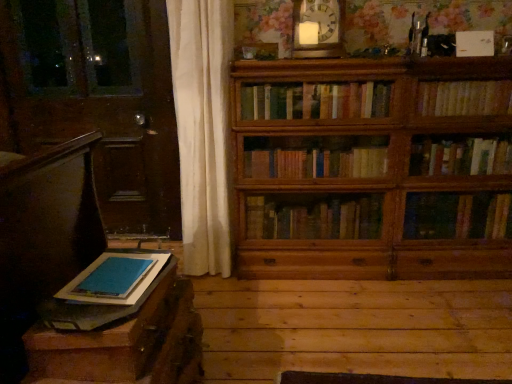
Where is `dark brown leather armchair at left`? dark brown leather armchair at left is located at coordinates (73, 278).

What is the approximate width of wooden table at lower left?

wooden table at lower left is 55.29 centimeters wide.

Describe the element at coordinates (115, 278) in the screenshot. I see `blue felt book at lower left, arranged as the second book when viewed from the back` at that location.

Identify the location of blue felt book at lower left, the first book ordered from the bottom. (115, 278).

Image resolution: width=512 pixels, height=384 pixels. What do you see at coordinates (373, 168) in the screenshot?
I see `wooden bookcase at right` at bounding box center [373, 168].

Identify the location of dark brown leather armchair at left. (73, 278).

Is wooden bookcase at right at the back of wooden table at lower left?

That's not correct — wooden table at lower left is not looking away from wooden bookcase at right.

What's the angular difference between wooden table at lower left and wooden bookcase at right's facing directions?

They differ by 0.715 degrees in their facing directions.

Is wooden table at lower left next to wooden bookcase at right?

wooden table at lower left and wooden bookcase at right are not in contact.

Is wooden table at lower left spatially inside wooden bookcase at right, or outside of it?

wooden table at lower left is outside wooden bookcase at right.

From the image's perspective, is wooden table at lower left on dark brown leather armchair at left?

No.

From a real-world perspective, is wooden table at lower left under dark brown leather armchair at left?

Yes, from a real-world perspective, wooden table at lower left is below dark brown leather armchair at left.

In the scene shown: Is wooden table at lower left inside the boundaries of dark brown leather armchair at left, or outside?

wooden table at lower left is not enclosed by dark brown leather armchair at left.

Considering the relative sizes of wooden bookcase at right and wooden table at lower left in the image provided, is wooden bookcase at right bigger than wooden table at lower left?

Yes, wooden bookcase at right is bigger than wooden table at lower left.

From the image's perspective, between wooden bookcase at right and wooden table at lower left, who is located below?

wooden table at lower left is shown below in the image.

Does wooden bookcase at right contain wooden table at lower left?

No, wooden table at lower left is located outside of wooden bookcase at right.

Locate an element on the screen. The width and height of the screenshot is (512, 384). table on the left of wooden bookcase at right is located at coordinates (120, 339).

Considering the positions of point (507, 96) and point (3, 355), is point (507, 96) closer or farther from the camera than point (3, 355)?

Clearly, point (507, 96) is more distant from the camera than point (3, 355).

From a real-world perspective, who is located lower, wooden bookshelf at right, which ranks as the first book in top-to-bottom order, or dark brown leather armchair at left?

In real-world perspective, dark brown leather armchair at left is lower.

Where is `armchair located in front of the wooden bookshelf at right, placed as the first book when sorted from back to front`? This screenshot has width=512, height=384. armchair located in front of the wooden bookshelf at right, placed as the first book when sorted from back to front is located at coordinates (73, 278).

In the image, is wooden bookshelf at right, placed as the first book when sorted from back to front, positioned in front of or behind dark brown leather armchair at left?

Visually, wooden bookshelf at right, placed as the first book when sorted from back to front, is located behind dark brown leather armchair at left.

From a real-world perspective, which is physically above, wooden table at lower left or wooden clock at upper center?

From a 3D spatial view, wooden clock at upper center is above.

Would you consider wooden table at lower left to be distant from wooden clock at upper center?

That's right, there is a large distance between wooden table at lower left and wooden clock at upper center.

Looking at this image, is wooden table at lower left thinner than wooden clock at upper center?

No.

Considering the sizes of objects wooden table at lower left and wooden clock at upper center in the image provided, who is smaller, wooden table at lower left or wooden clock at upper center?

Smaller between the two is wooden clock at upper center.

From a real-world perspective, is wooden clock at upper center on wooden table at lower left?

Indeed, from a real-world perspective, wooden clock at upper center stands above wooden table at lower left.

What's the angular difference between wooden clock at upper center and wooden table at lower left's facing directions?

The angle between the facing direction of wooden clock at upper center and the facing direction of wooden table at lower left is 0.111 degrees.

From the image's perspective, is wooden clock at upper center above wooden table at lower left?

Yes, from the image's perspective, wooden clock at upper center is above wooden table at lower left.

Can you confirm if wooden clock at upper center is positioned to the right of wooden table at lower left?

Correct, you'll find wooden clock at upper center to the right of wooden table at lower left.

Which point is more distant from viewer, (312, 20) or (365, 179)?

The point (365, 179) is farther from the camera.

Which of these two, wooden clock at upper center or wooden bookcase at right, is bigger?

With larger size is wooden bookcase at right.

From a real-world perspective, is wooden clock at upper center physically located above or below wooden bookcase at right?

From a real-world perspective, wooden clock at upper center is physically above wooden bookcase at right.

Where is `bookcase lying on the right of wooden table at lower left`? This screenshot has width=512, height=384. bookcase lying on the right of wooden table at lower left is located at coordinates (373, 168).

I want to click on armchair in front of the wooden table at lower left, so click(73, 278).

Based on their spatial positions, is wooden clock at upper center or wooden bookcase at right closer to dark brown leather armchair at left?

Based on the image, wooden bookcase at right appears to be nearer to dark brown leather armchair at left.

From the image, which object appears to be nearer to wooden table at lower left, dark brown leather armchair at left or wooden bookcase at right?

Based on the image, dark brown leather armchair at left appears to be nearer to wooden table at lower left.

From the image, which object appears to be farther from wooden bookshelf at right, which ranks as the first book in top-to-bottom order, wooden clock at upper center or wooden bookcase at right?

The object further to wooden bookshelf at right, which ranks as the first book in top-to-bottom order, is wooden clock at upper center.

Considering their positions, is blue felt book at lower left, the 2th book from the top, positioned closer to wooden bookshelf at right, which ranks as the 1th book in right-to-left order, than wooden bookcase at right?

wooden bookcase at right is closer to wooden bookshelf at right, which ranks as the 1th book in right-to-left order.

Which object lies further to the anchor point wooden table at lower left, dark brown leather armchair at left or blue felt book at lower left, arranged as the second book when viewed from the back?

blue felt book at lower left, arranged as the second book when viewed from the back, is positioned further to the anchor wooden table at lower left.

When comparing their distances from wooden clock at upper center, does dark brown leather armchair at left or wooden bookcase at right seem closer?

wooden bookcase at right is positioned closer to the anchor wooden clock at upper center.

Estimate the real-world distances between objects in this image. Which object is further from wooden clock at upper center, dark brown leather armchair at left or wooden table at lower left?

The object further to wooden clock at upper center is wooden table at lower left.

Based on the photo, estimate the real-world distances between objects in this image. Which object is closer to wooden bookshelf at right, arranged as the 2th book when viewed from the front, blue felt book at lower left, marked as the 1th book in a left-to-right arrangement, or wooden table at lower left?

blue felt book at lower left, marked as the 1th book in a left-to-right arrangement, lies closer to wooden bookshelf at right, arranged as the 2th book when viewed from the front, than the other object.

Locate an element on the screen. Image resolution: width=512 pixels, height=384 pixels. book between dark brown leather armchair at left and wooden bookcase at right is located at coordinates (115, 278).

This screenshot has width=512, height=384. Identify the location of clock located between blue felt book at lower left, the 2th book from the top, and wooden bookcase at right in the left-right direction. (317, 28).

The height and width of the screenshot is (384, 512). What are the coordinates of `armchair between wooden clock at upper center and wooden table at lower left from top to bottom` in the screenshot? It's located at (73, 278).

This screenshot has height=384, width=512. I want to click on bookcase between wooden clock at upper center and wooden bookshelf at right, which ranks as the 1th book in right-to-left order, in the horizontal direction, so click(373, 168).